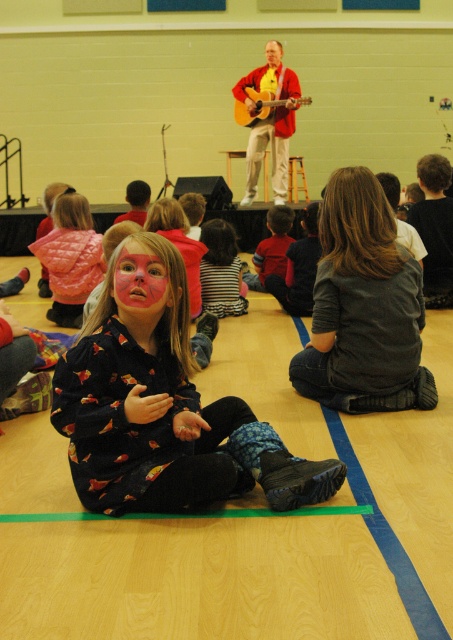
Is dark gray sweater at center positioned behind acoustic wood guitar at upper center?

No, dark gray sweater at center is closer to the viewer.

Consider the image. Can you confirm if dark gray sweater at center is thinner than acoustic wood guitar at upper center?

Correct, dark gray sweater at center's width is less than acoustic wood guitar at upper center's.

Locate an element on the screen. This screenshot has height=640, width=453. dark gray sweater at center is located at coordinates (364, 307).

Does dark gray sweater at center have a lesser height compared to matte pink face paint at lower left?

No, dark gray sweater at center is not shorter than matte pink face paint at lower left.

Is dark gray sweater at center positioned before matte pink face paint at lower left?

Yes, dark gray sweater at center is in front of matte pink face paint at lower left.

Who is more forward, (308, 352) or (57, 269)?

Positioned in front is point (308, 352).

The height and width of the screenshot is (640, 453). I want to click on dark gray sweater at center, so click(x=364, y=307).

Is point (144, 248) positioned in front of point (269, 100)?

Yes.

Where is `pink matte face paint at center`? Image resolution: width=453 pixels, height=640 pixels. pink matte face paint at center is located at coordinates (139, 280).